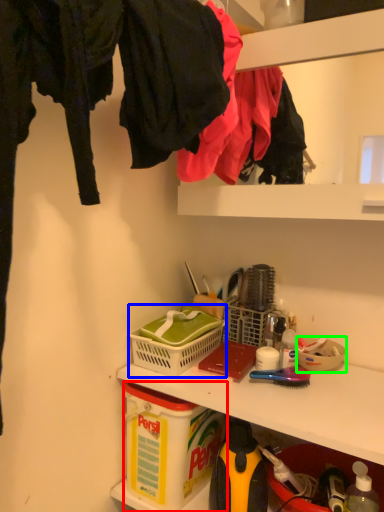
Question: Which is nearer to the box (highlighted by a red box)? picnic basket (highlighted by a blue box) or bowl (highlighted by a green box).

Choices:
 (A) picnic basket
 (B) bowl

Answer: (A)